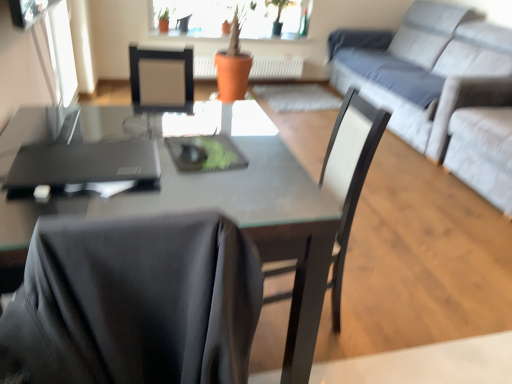
In order to face matte black desk at center, should I rotate leftwards or rightwards?

To face it directly, rotate left by 13.463 degrees.

The image size is (512, 384). Identify the location of matte black desk at center. (231, 217).

What do you see at coordinates (439, 71) in the screenshot? I see `light gray fabric couch at upper right` at bounding box center [439, 71].

In order to face transparent glass window screen at upper left, should I rotate leftwards or rightwards?

You should look left and rotate roughly 23.604 degrees.

Image resolution: width=512 pixels, height=384 pixels. What do you see at coordinates (349, 174) in the screenshot?
I see `black matte chair at center` at bounding box center [349, 174].

Find the location of a particular element. This screenshot has height=384, width=512. matte black desk at center is located at coordinates (231, 217).

In the scene shown: Is orange matte pot at center taller than matte black desk at center?

No.

From a real-world perspective, is orange matte pot at center beneath matte black desk at center?

Yes.

Find the location of a particular element. This screenshot has height=384, width=512. radiator that appears behind the matte black desk at center is located at coordinates (276, 67).

Considering their positions, is orange matte pot at center located in front of or behind matte black desk at center?

orange matte pot at center is behind matte black desk at center.

Is light gray fabric couch at upper right inside or outside of transparent glass window screen at upper left?

light gray fabric couch at upper right is located beyond the bounds of transparent glass window screen at upper left.

Considering the sizes of objects light gray fabric couch at upper right and transparent glass window screen at upper left in the image provided, who is taller, light gray fabric couch at upper right or transparent glass window screen at upper left?

With more height is light gray fabric couch at upper right.

From a real-world perspective, does light gray fabric couch at upper right sit lower than transparent glass window screen at upper left?

No, from a real-world perspective, light gray fabric couch at upper right is not under transparent glass window screen at upper left.

Measure the distance between black matte chair at center and black matte laptop at left.

black matte chair at center and black matte laptop at left are 26.03 inches apart.

Based on the photo, is black matte chair at center smaller than black matte laptop at left?

No, black matte chair at center is not smaller than black matte laptop at left.

Is black matte chair at center facing away from black matte laptop at left?

No.

Who is more distant, black matte chair at center or black matte laptop at left?

Positioned behind is black matte chair at center.

Can you confirm if black matte laptop at left is taller than orange matte pot at center?

Incorrect, the height of black matte laptop at left is not larger of that of orange matte pot at center.

Where is `radiator on the right of black matte laptop at left`? The height and width of the screenshot is (384, 512). radiator on the right of black matte laptop at left is located at coordinates click(276, 67).

Which object is wider, black matte laptop at left or orange matte pot at center?

black matte laptop at left.

Considering the points (96, 171) and (289, 69), which point is behind, point (96, 171) or point (289, 69)?

Positioned behind is point (289, 69).

Relative to matte black desk at center, is transparent glass window screen at upper left in front or behind?

transparent glass window screen at upper left is positioned farther from the viewer than matte black desk at center.

Is transparent glass window screen at upper left oriented away from matte black desk at center?

transparent glass window screen at upper left does not have its back to matte black desk at center.

Is point (62, 79) closer or farther from the camera than point (302, 179)?

Clearly, point (62, 79) is more distant from the camera than point (302, 179).

How different are the orientations of transparent glass window screen at upper left and matte black desk at center in degrees?

There is a 0.0582-degree angle between the facing directions of transparent glass window screen at upper left and matte black desk at center.

From the image's perspective, between transparent glass window screen at upper left and black matte chair at center, which one is located above?

transparent glass window screen at upper left appears higher in the image.

Do you think transparent glass window screen at upper left is within black matte chair at center, or outside of it?

transparent glass window screen at upper left lies outside black matte chair at center.

Between transparent glass window screen at upper left and black matte chair at center, which one has larger width?

black matte chair at center.

From their relative heights in the image, would you say transparent glass window screen at upper left is taller or shorter than black matte chair at center?

Clearly, transparent glass window screen at upper left is shorter compared to black matte chair at center.

From the picture: What's the angular difference between matte black desk at center and black matte laptop at left's facing directions?

The facing directions of matte black desk at center and black matte laptop at left are 89.1 degrees apart.

How far apart are matte black desk at center and black matte laptop at left?

matte black desk at center and black matte laptop at left are 22.10 centimeters apart.

Find the location of a particular element. This screenshot has height=384, width=512. laptop behind the matte black desk at center is located at coordinates (84, 164).

In the scene shown: Is matte black desk at center far from black matte laptop at left?

matte black desk at center is actually quite close to black matte laptop at left.

This screenshot has width=512, height=384. In order to click on radiator above the matte black desk at center (from the image's perspective) in this screenshot , I will do `click(276, 67)`.

The image size is (512, 384). Find the location of `window screen behind the light gray fabric couch at upper right`. window screen behind the light gray fabric couch at upper right is located at coordinates (61, 52).

Based on their spatial positions, is transparent glass window screen at upper left or black matte chair at center further from black matte laptop at left?

transparent glass window screen at upper left is further to black matte laptop at left.

Based on their spatial positions, is transparent glass window screen at upper left or orange matte pot at center closer to black matte laptop at left?

Among the two, transparent glass window screen at upper left is located nearer to black matte laptop at left.

Looking at the image, which one is located further to matte black desk at center, black matte chair at center or transparent glass window screen at upper left?

Among the two, transparent glass window screen at upper left is located further to matte black desk at center.

From the image, which object appears to be nearer to orange matte pot at center, light gray fabric couch at upper right or matte black desk at center?

Based on the image, light gray fabric couch at upper right appears to be nearer to orange matte pot at center.

Looking at the image, which one is located further to orange matte pot at center, black matte chair at center or matte black desk at center?

The object further to orange matte pot at center is matte black desk at center.

Estimate the real-world distances between objects in this image. Which object is closer to black matte chair at center, orange matte pot at center or black matte laptop at left?

Based on the image, black matte laptop at left appears to be nearer to black matte chair at center.

When comparing their distances from matte black desk at center, does light gray fabric couch at upper right or black matte laptop at left seem closer?

black matte laptop at left lies closer to matte black desk at center than the other object.

Looking at the image, which one is located closer to orange matte pot at center, light gray fabric couch at upper right or transparent glass window screen at upper left?

light gray fabric couch at upper right is positioned closer to the anchor orange matte pot at center.

The height and width of the screenshot is (384, 512). I want to click on chair between matte black desk at center and light gray fabric couch at upper right from front to back, so click(x=349, y=174).

Image resolution: width=512 pixels, height=384 pixels. Find the location of `window screen located between black matte laptop at left and orange matte pot at center in the depth direction`. window screen located between black matte laptop at left and orange matte pot at center in the depth direction is located at coordinates (61, 52).

Where is `desk between black matte laptop at left and black matte chair at center from left to right`? The image size is (512, 384). desk between black matte laptop at left and black matte chair at center from left to right is located at coordinates (231, 217).

The image size is (512, 384). Identify the location of window screen between matte black desk at center and orange matte pot at center from front to back. (61, 52).